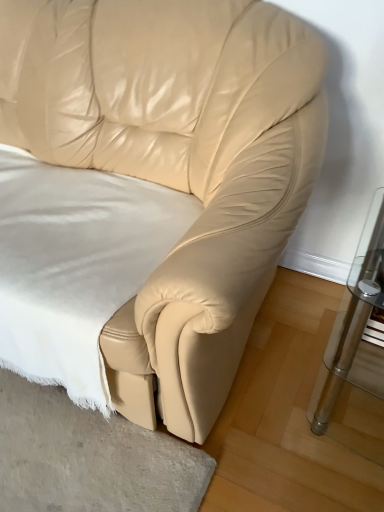
Image resolution: width=384 pixels, height=512 pixels. Find the location of `free space that is to the left of clear glass table at right`. free space that is to the left of clear glass table at right is located at coordinates (273, 390).